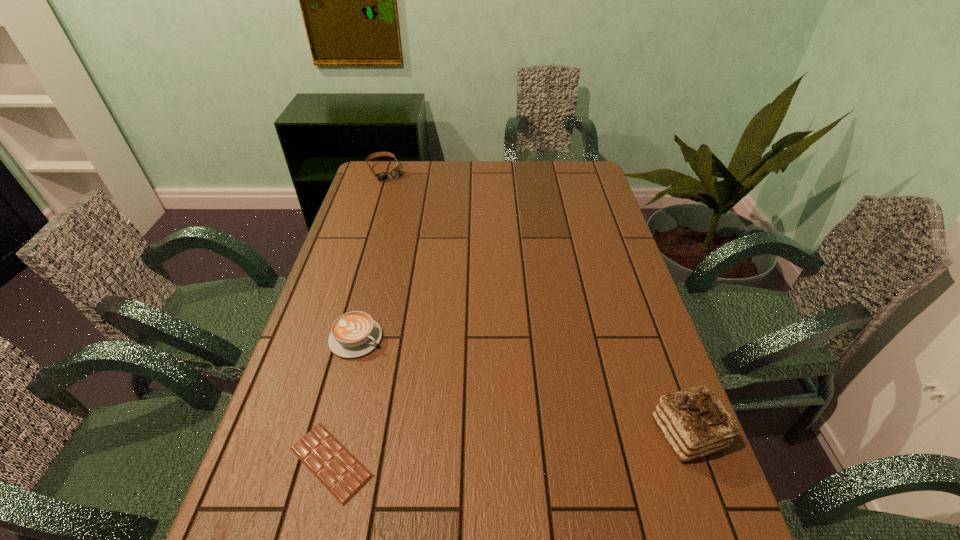
The image size is (960, 540). What are the coordinates of `vacant position located 0.270m on the front-facing side of the goggles` in the screenshot? It's located at (415, 218).

Identify the location of vacant space positioned 0.300m on the front-facing side of the goggles. Image resolution: width=960 pixels, height=540 pixels. (418, 222).

This screenshot has height=540, width=960. Find the location of `free space located 0.350m on the front-facing side of the goggles`. free space located 0.350m on the front-facing side of the goggles is located at coordinates (423, 230).

Locate an element on the screen. object present at the far edge is located at coordinates (396, 172).

What are the coordinates of `object at the near edge` in the screenshot? It's located at (343, 475).

Where is `chocolate bar present at the left edge`? The height and width of the screenshot is (540, 960). chocolate bar present at the left edge is located at coordinates pyautogui.click(x=343, y=475).

This screenshot has height=540, width=960. What are the coordinates of `cappuccino that is at the left edge` in the screenshot? It's located at (353, 334).

At what (x,y) coordinates should I click in order to perform the action: click on goggles that is at the left edge. Please return your answer as a coordinate pair (x, y). This screenshot has width=960, height=540. Looking at the image, I should click on tap(396, 172).

I want to click on object that is at the right edge, so click(694, 422).

This screenshot has height=540, width=960. What are the coordinates of `object situated at the far left corner` in the screenshot? It's located at (396, 172).